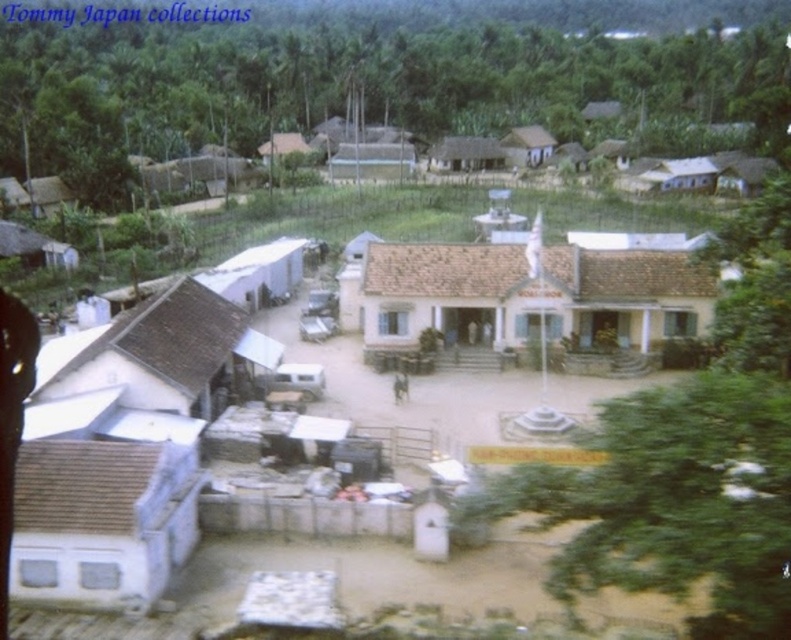
You are standing at the origin point of the coordinate system in this village scene. You need to locate the white matte building at center. What are its coordinates?

The white matte building at center is located at coordinates point (536, 301).